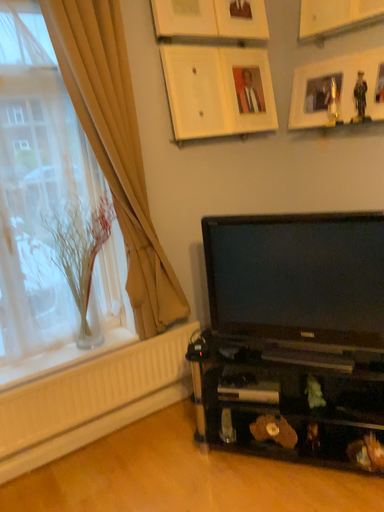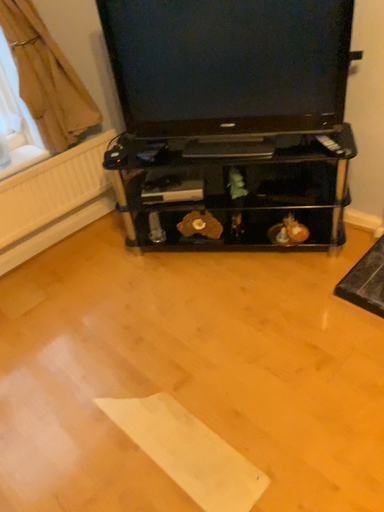
Question: How did the camera likely rotate when shooting the video?

Choices:
 (A) rotated downward
 (B) rotated upward

Answer: (A)